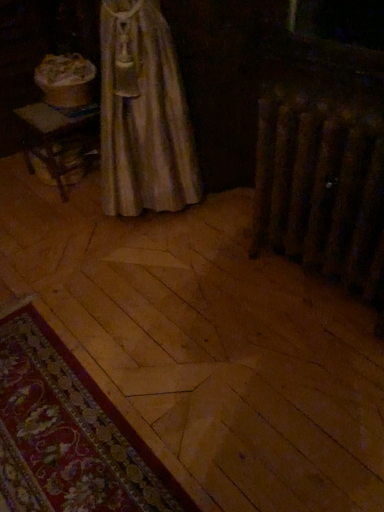
At what (x,y) coordinates should I click in order to perform the action: click on blank space situated above floral carpet at lower left (from a real-world perspective). Please return your answer as a coordinate pair (x, y). Image resolution: width=384 pixels, height=512 pixels. Looking at the image, I should click on (53, 414).